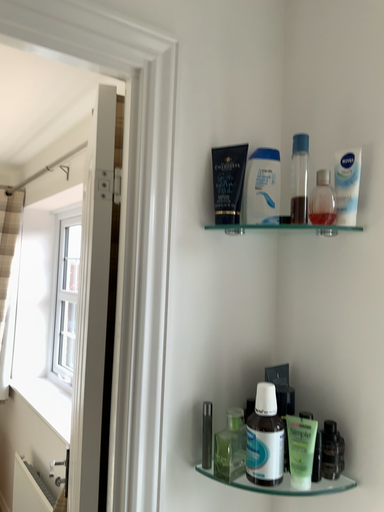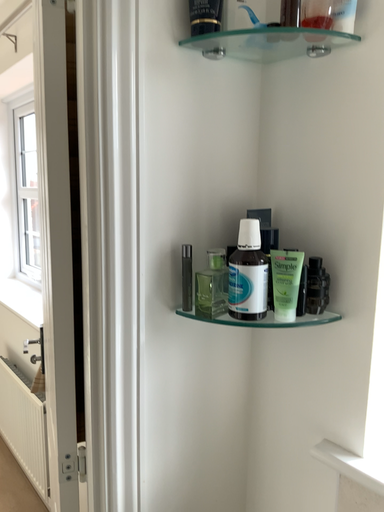
Question: How did the camera likely rotate when shooting the video?

Choices:
 (A) rotated downward
 (B) rotated upward

Answer: (A)